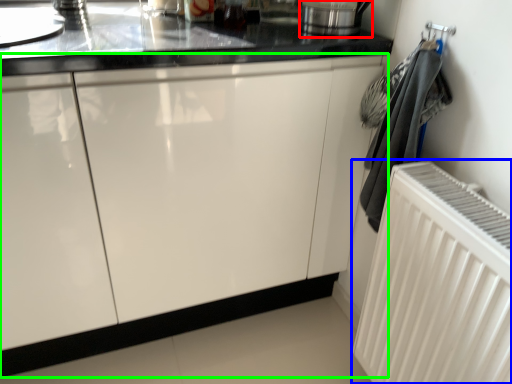
Question: Which object is positioned closest to appliance (highlighted by a red box)? Select from radiator (highlighted by a blue box) and cabinetry (highlighted by a green box).

Choices:
 (A) radiator
 (B) cabinetry

Answer: (B)